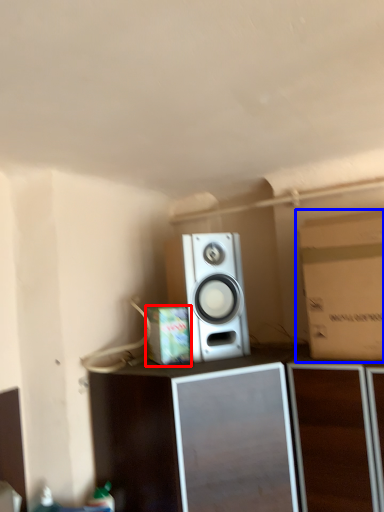
Question: Which object is closer to the camera taking this photo, cardboard box (highlighted by a red box) or cardboard box (highlighted by a blue box)?

Choices:
 (A) cardboard box
 (B) cardboard box

Answer: (B)